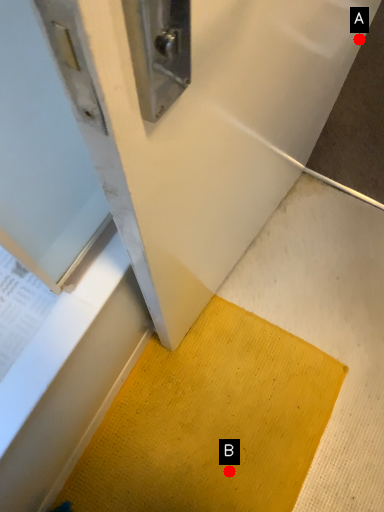
Question: Two points are circled on the image, labeled by A and B beside each circle. Among these points, which one is farthest from the camera?

Choices:
 (A) A is further
 (B) B is further

Answer: (B)